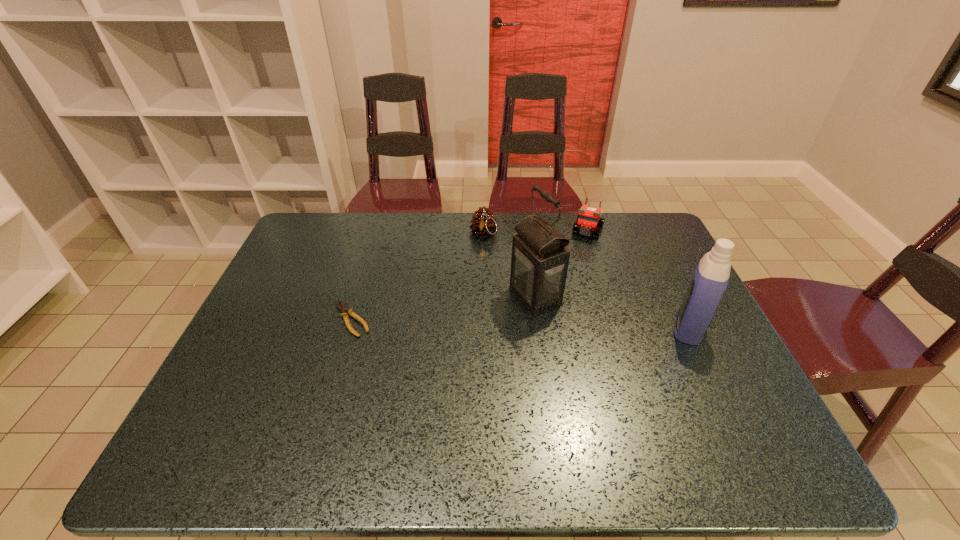
You are a GUI agent. You are given a task and a screenshot of the screen. Output one action in this format:
    pyautogui.click(x=<x>, y=<y>)
    Task: Click on the pinecone located at the far edge
    This screenshot has width=960, height=540.
    Given the screenshot: What is the action you would take?
    pyautogui.click(x=483, y=223)

Find the location of a particular element. object located at the right edge is located at coordinates (711, 277).

In the image, there is a desktop. Where is `vacant space at the far edge`? This screenshot has height=540, width=960. vacant space at the far edge is located at coordinates [x=431, y=234].

In the image, there is a desktop. At what (x,y) coordinates should I click in order to perform the action: click on free space at the near edge. Please return your answer as a coordinate pair (x, y). This screenshot has height=540, width=960. Looking at the image, I should click on pyautogui.click(x=562, y=402).

In the image, there is a desktop. At what (x,y) coordinates should I click in order to perform the action: click on free space at the left edge. Please return your answer as a coordinate pair (x, y). Image resolution: width=960 pixels, height=540 pixels. Looking at the image, I should click on (254, 362).

The height and width of the screenshot is (540, 960). What are the coordinates of `vacant point at the right edge` in the screenshot? It's located at (667, 292).

Where is `blank space at the far left corner`? This screenshot has height=540, width=960. blank space at the far left corner is located at coordinates coord(313,240).

What are the coordinates of `free space that is in between the rightmost object and the pinecone` in the screenshot? It's located at (586, 281).

Identify the location of vacant space in between the second tallest object and the third object from right to left. The image size is (960, 540). (612, 312).

Locate an element on the screen. empty space between the detergent and the third object from left to right is located at coordinates (612, 312).